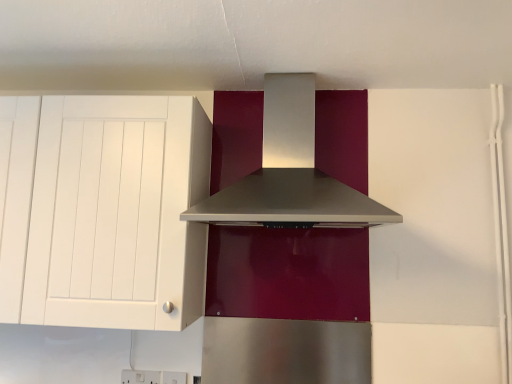
Question: Is point (193, 253) closer or farther from the camera than point (272, 182)?

Choices:
 (A) closer
 (B) farther

Answer: (A)

Question: In terms of height, does white matte cabinet at left look taller or shorter compared to satin silver range hood at center?

Choices:
 (A) tall
 (B) short

Answer: (A)

Question: In the image, is white matte cabinet at left on the left side or the right side of satin silver range hood at center?

Choices:
 (A) left
 (B) right

Answer: (A)

Question: Is satin silver range hood at center to the left or to the right of white matte cabinet at left in the image?

Choices:
 (A) left
 (B) right

Answer: (B)

Question: From the image's perspective, is satin silver range hood at center positioned above or below white matte cabinet at left?

Choices:
 (A) above
 (B) below

Answer: (A)

Question: Is satin silver range hood at center bigger or smaller than white matte cabinet at left?

Choices:
 (A) big
 (B) small

Answer: (B)

Question: Is satin silver range hood at center in front of or behind white matte cabinet at left in the image?

Choices:
 (A) behind
 (B) front

Answer: (B)